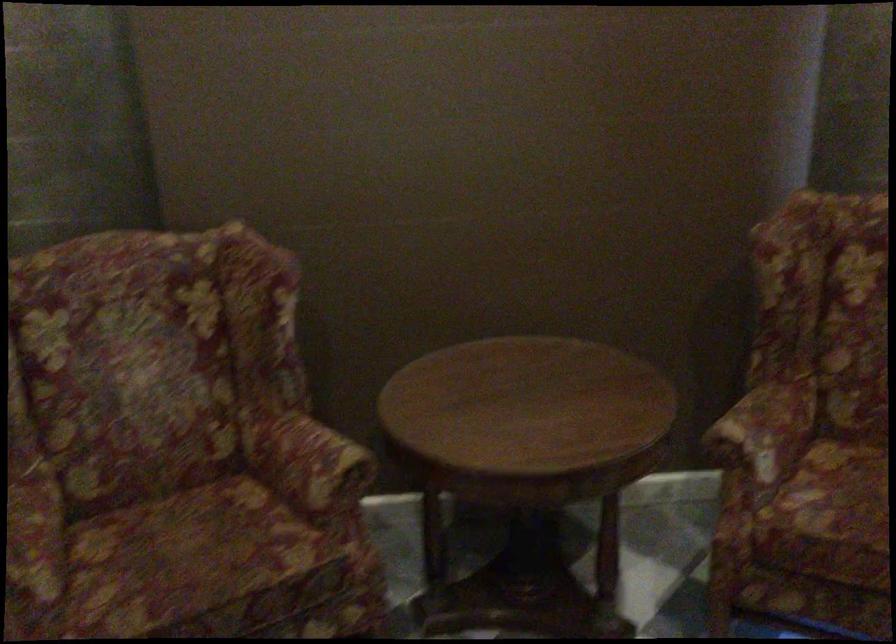
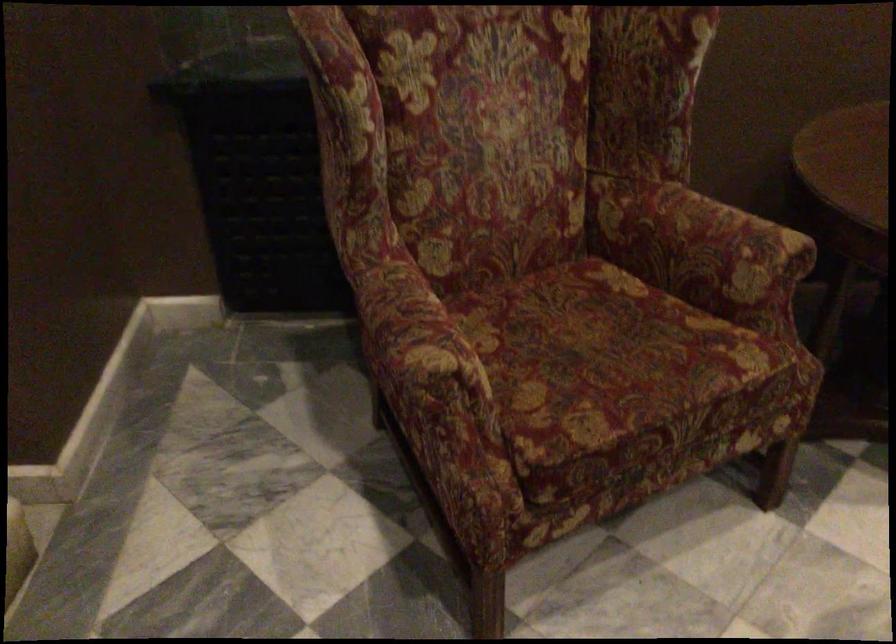
In the second image, find the point that corresponds to pixel 297 460 in the first image.

(700, 243)